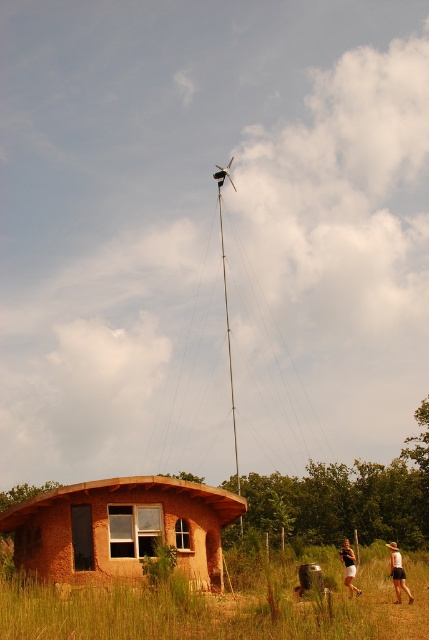
Question: Is brown clay hut at lower left bigger than tan fabric shorts at lower right?

Choices:
 (A) no
 (B) yes

Answer: (A)

Question: Is green grass at lower center smaller than tan shorts at lower right?

Choices:
 (A) yes
 (B) no

Answer: (B)

Question: Which object is closer to the camera taking this photo?

Choices:
 (A) green grass at lower center
 (B) tan shorts at lower right

Answer: (A)

Question: Is tan shorts at lower right thinner than tan fabric shorts at lower right?

Choices:
 (A) no
 (B) yes

Answer: (A)

Question: Which of the following is the farthest from the observer?

Choices:
 (A) green grass at lower center
 (B) brown clay hut at lower left
 (C) tan fabric shorts at lower right
 (D) tan shorts at lower right

Answer: (B)

Question: Which is farther from the brown clay hut at lower left?

Choices:
 (A) green grass at lower center
 (B) tan fabric shorts at lower right
 (C) tan shorts at lower right

Answer: (C)